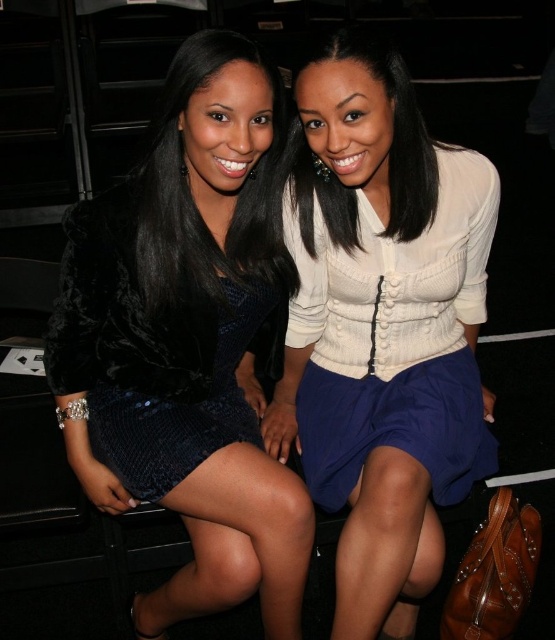
Can you confirm if velvet black dress at left is taller than satin white blouse at center?

→ Yes, velvet black dress at left is taller than satin white blouse at center.

Does point (165, 186) lie behind point (360, 60)?

Yes, it is behind point (360, 60).

At what (x,y) coordinates should I click in order to perform the action: click on velvet black dress at left. Please return your answer as a coordinate pair (x, y). This screenshot has height=640, width=555. Looking at the image, I should click on (184, 342).

Who is higher up, white knit cardigan at center or velvet black dress at center?

velvet black dress at center is above.

Does white knit cardigan at center have a lesser width compared to velvet black dress at center?

No.

Is point (334, 243) positioned in front of point (244, 260)?

No, it is not.

Locate an element on the screen. This screenshot has height=640, width=555. white knit cardigan at center is located at coordinates (381, 326).

Does point (466, 326) come farther from viewer compared to point (90, 413)?

That is True.

Is white knit cardigan at center to the left of black sequined dress at center from the viewer's perspective?

No, white knit cardigan at center is not to the left of black sequined dress at center.

Is point (388, 141) closer to viewer compared to point (60, 316)?

Yes, point (388, 141) is in front of point (60, 316).

I want to click on white knit cardigan at center, so click(x=381, y=326).